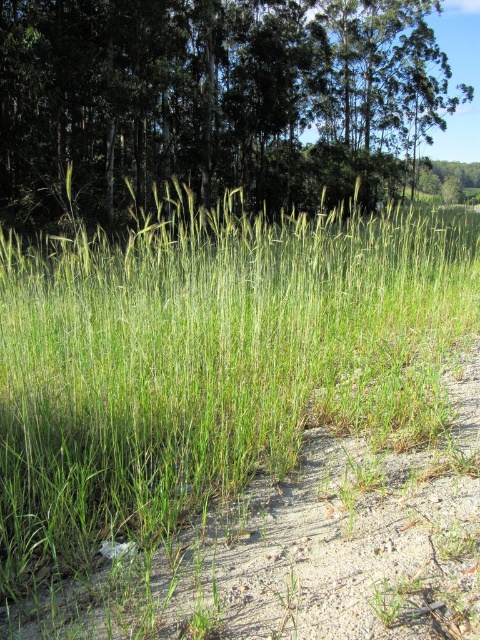
You are standing in the middle of the green grassy at center and want to reach the green leafy tree at upper center. Which direction should you walk to get closer to the tree?

The green grassy at center is smaller than the green leafy tree at upper center, so you should walk forward towards the upper center direction to get closer to the tree.